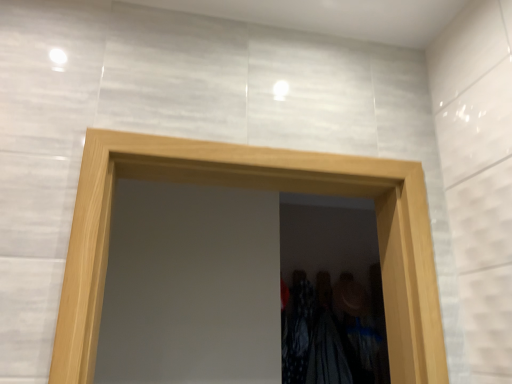
This screenshot has width=512, height=384. Identify the location of patterned fabric at center. (297, 329).

What do you see at coordinates (297, 329) in the screenshot? I see `patterned fabric at center` at bounding box center [297, 329].

This screenshot has height=384, width=512. I want to click on patterned fabric at center, so click(297, 329).